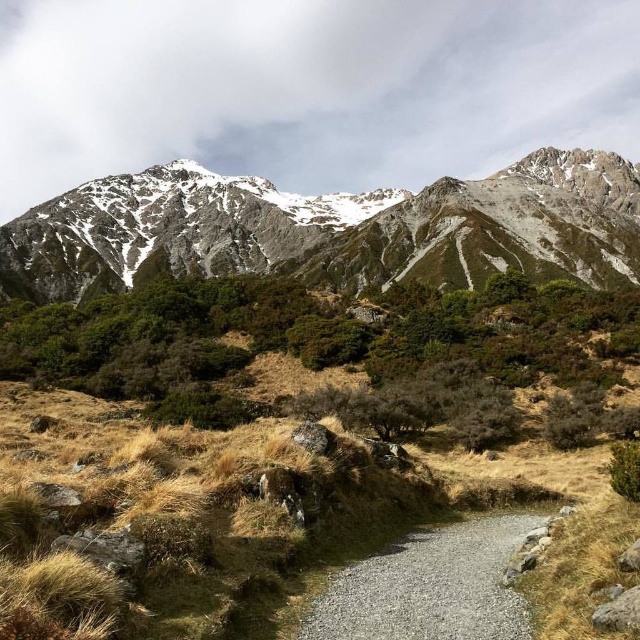
Who is taller, snowy granite mountain range at upper center or gravelly path at center?

snowy granite mountain range at upper center is taller.

This screenshot has width=640, height=640. I want to click on snowy granite mountain range at upper center, so click(x=333, y=228).